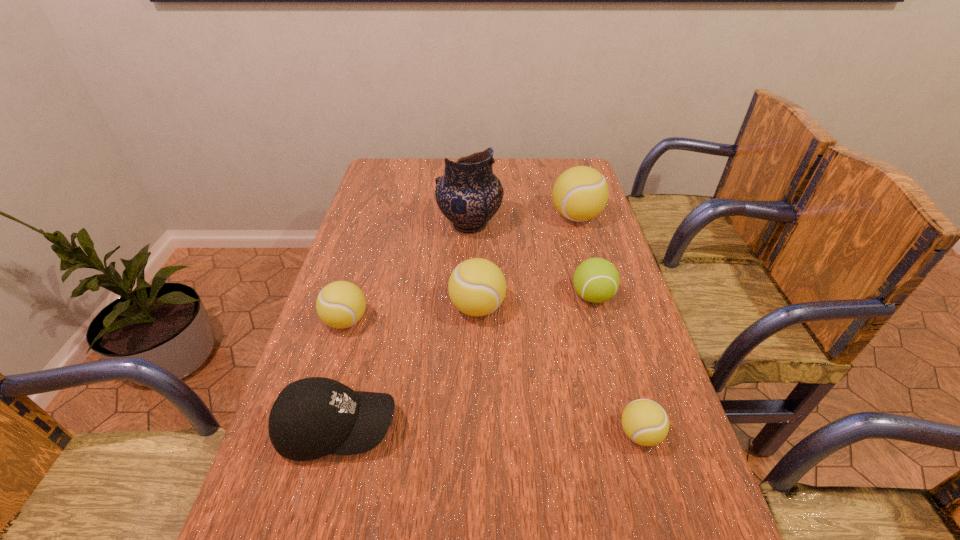
You are a GUI agent. You are given a task and a screenshot of the screen. Output one action in this format:
    pyautogui.click(x=<x>, y=<y>)
    Task: Click on the pottery
    The width and height of the screenshot is (960, 540).
    Given the screenshot: What is the action you would take?
    pyautogui.click(x=468, y=194)

In order to click on the tallest object in this screenshot , I will do `click(468, 194)`.

The image size is (960, 540). I want to click on the tallest tennis ball, so click(580, 193).

Where is `the farthest tennis ball`? Image resolution: width=960 pixels, height=540 pixels. the farthest tennis ball is located at coordinates coord(580,193).

What are the coordinates of `the third smallest yellow tennis ball` in the screenshot? It's located at point(477,287).

The height and width of the screenshot is (540, 960). I want to click on the fourth tennis ball from right to left, so click(x=477, y=287).

The height and width of the screenshot is (540, 960). Identify the location of baseball cap. (313, 417).

I want to click on the leftmost tennis ball, so click(x=341, y=304).

At what (x,y) coordinates should I click in order to perform the action: click on the third biggest yellow tennis ball. Please return your answer as a coordinate pair (x, y). Looking at the image, I should click on [341, 304].

Where is `green tennis ball`? The image size is (960, 540). green tennis ball is located at coordinates (596, 280).